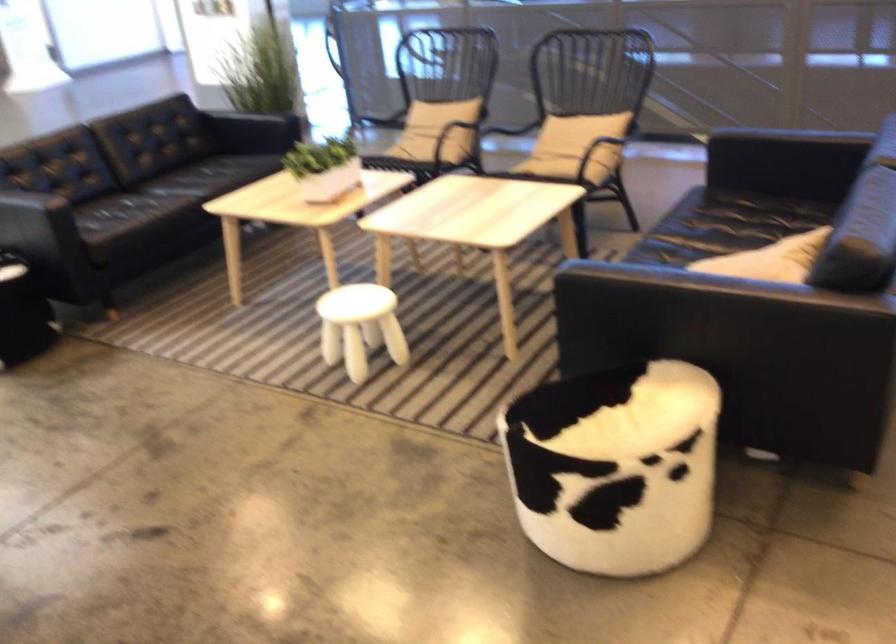
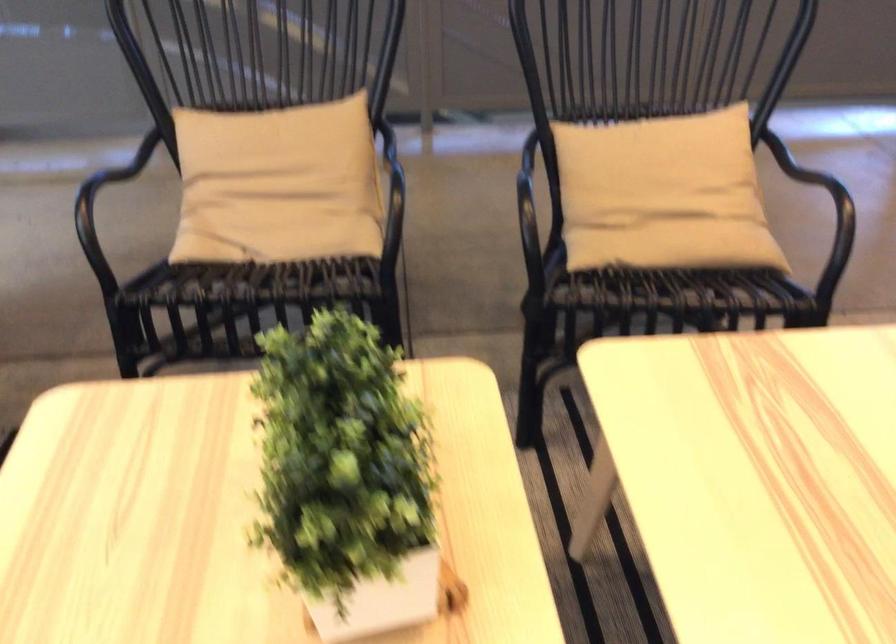
Where in the second image is the point corresponding to point (553, 138) from the first image?

(662, 194)